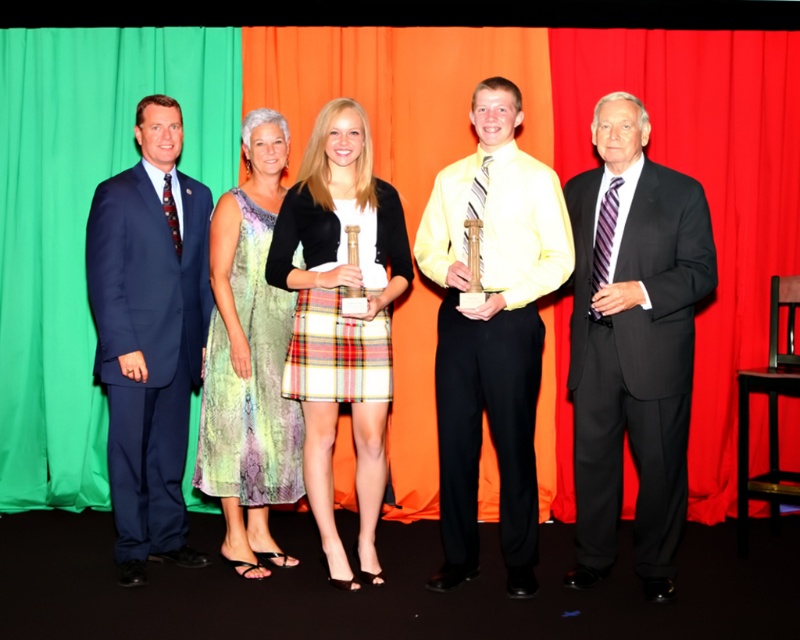
Question: Is dark gray suit at center below yellow striped tie at center?

Choices:
 (A) yes
 (B) no

Answer: (A)

Question: Which point is farther to the camera?

Choices:
 (A) (472, 460)
 (B) (696, 220)
 (C) (284, 280)
 (D) (222, 248)

Answer: (D)

Question: Can you confirm if dark gray suit at center is positioned to the left of multicolored printed dress at center?

Choices:
 (A) yes
 (B) no

Answer: (B)

Question: Is yellow striped tie at center above plaid fabric kilt at center?

Choices:
 (A) no
 (B) yes

Answer: (B)

Question: Among these points, which one is farthest from the camera?

Choices:
 (A) click(666, 240)
 (B) click(512, 492)
 (C) click(346, 138)

Answer: (B)

Question: Which of the following is the farthest from the observer?

Choices:
 (A) yellow striped tie at center
 (B) multicolored printed dress at center

Answer: (B)